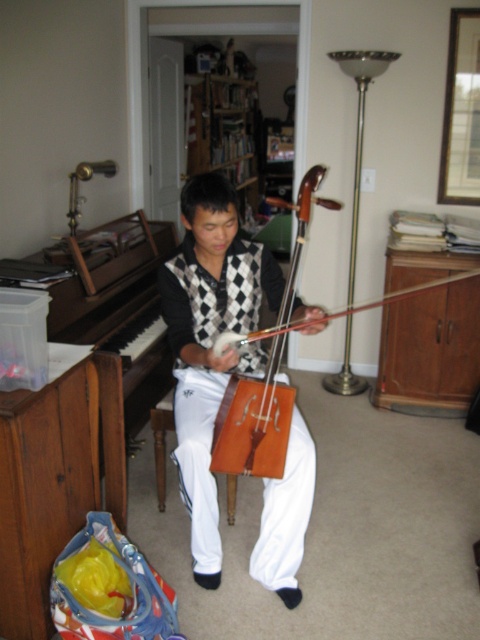
You are a musician who wants to place a new music stand between the wooden violin at center and the brown polished wood piano at left. Based on their positions, which side of the music stand should face the violin and which should face the piano?

The wooden violin at center is to the right of the brown polished wood piano at left. Therefore, the side of the music stand facing the wooden violin at center should be its right side, and the side facing the brown polished wood piano at left should be its left side.

You are standing in the room and want to take a closer look at the point marked at coordinates (104, 272). If you move forward 5 feet, will you be able to reach that point?

The point at (104, 272) is 8.19 feet away from the camera. Moving forward 5 feet would leave you 3.19 feet away from the point, so yes, you can reach it.

You are a photographer setting up a shoot in this room. You need to place a microphone exactly at the center of the room, which is at point coordinates. Where should you place the microphone relative to the wooden violin at center?

The wooden violin at center is located at point coordinates, so you should place the microphone at the center of the room, which is the same location as the wooden violin at center.